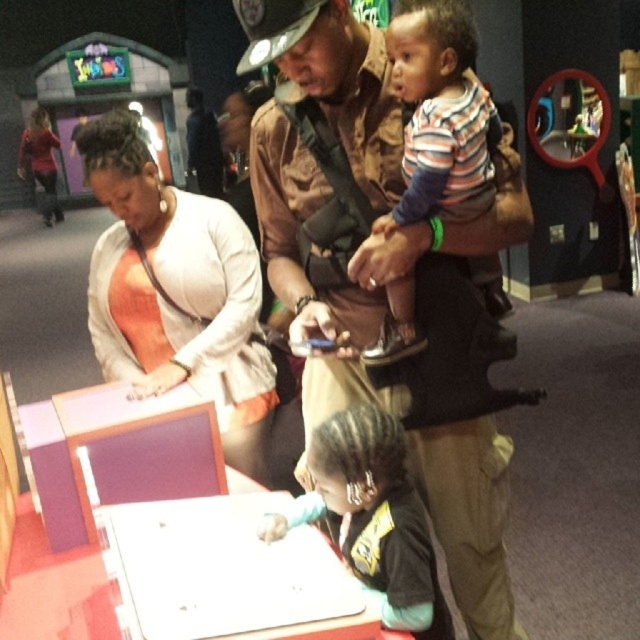
Question: Does orange fabric shirt at center have a larger size compared to striped cotton shirt at upper center?

Choices:
 (A) yes
 (B) no

Answer: (A)

Question: Which point is farther from the camera taking this photo?

Choices:
 (A) (154, 193)
 (B) (401, 259)
 (C) (435, 67)
 (D) (410, 548)

Answer: (A)

Question: Does orange fabric shirt at center have a smaller size compared to black fabric shirt at lower center?

Choices:
 (A) no
 (B) yes

Answer: (A)

Question: Estimate the real-world distances between objects in this image. Which object is farther from the brown leather jacket at center?

Choices:
 (A) striped cotton shirt at upper center
 (B) orange fabric shirt at center

Answer: (B)

Question: Estimate the real-world distances between objects in this image. Which object is farther from the brown leather jacket at center?

Choices:
 (A) striped cotton shirt at upper center
 (B) black fabric shirt at lower center

Answer: (B)

Question: Is brown leather jacket at center thinner than black fabric shirt at lower center?

Choices:
 (A) no
 (B) yes

Answer: (A)